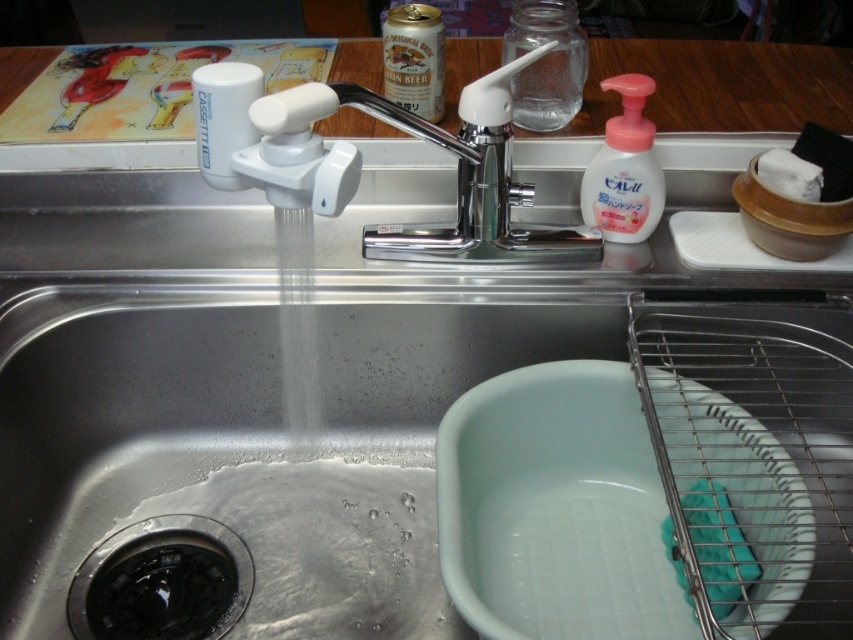
What object is located at the coordinates point (457,170)?

The chrome metallic faucet at upper center is located at point (457,170).

You are standing in front of the kitchen sink and want to place both the black rubber drain at lower left and the white matte plate at right into a drawer. Which object should you put into the drawer first based on their positions?

You should put the black rubber drain at lower left into the drawer first because it is closer to you than the white matte plate at right.

You are trying to determine which object is wider between the chrome metallic faucet at upper center and the black rubber drain at lower left. Based on the scene, which one is wider?

The chrome metallic faucet at upper center is wider than the black rubber drain at lower left according to the description.